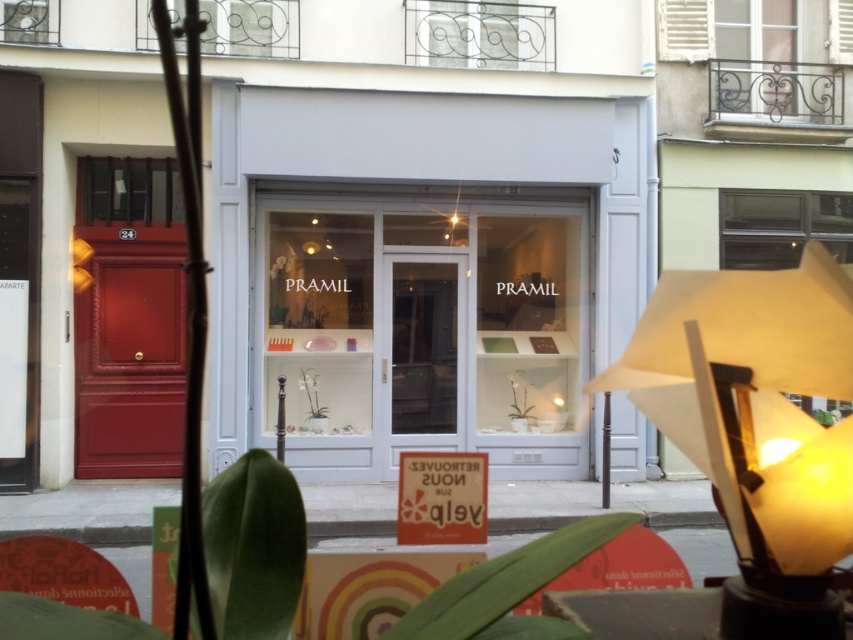
Question: Can you confirm if green leafy plant at lower left is positioned to the right of clear glass window at upper left?

Choices:
 (A) yes
 (B) no

Answer: (A)

Question: Considering the relative positions of green leafy plant at lower left and clear glass window at upper right in the image provided, where is green leafy plant at lower left located with respect to clear glass window at upper right?

Choices:
 (A) below
 (B) above

Answer: (A)

Question: Estimate the real-world distances between objects in this image. Which object is closer to the transparent glass shop window at center?

Choices:
 (A) metallic wrought iron at upper center
 (B) black metal bars at left
 (C) clear glass window at upper right
 (D) green leafy plant at lower left

Answer: (B)

Question: Among these objects, which one is nearest to the camera?

Choices:
 (A) matte orange sign at center
 (B) white glass door at center
 (C) metallic wrought iron at upper center
 (D) transparent glass shop window at center

Answer: (A)

Question: Which of the following is the closest to the observer?

Choices:
 (A) (322, 408)
 (B) (457, 378)
 (C) (570, 538)

Answer: (C)

Question: Does smooth glossy door at left have a lesser width compared to matte orange sign at center?

Choices:
 (A) no
 (B) yes

Answer: (A)